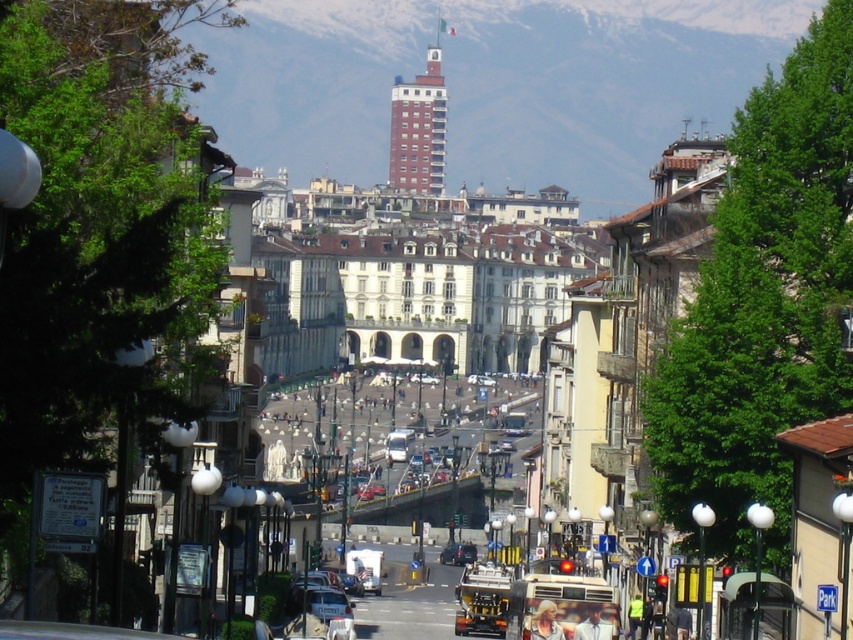
From the picture: Can you confirm if white snow-covered mountain at upper center is positioned above metallic silver car at center?

Indeed, white snow-covered mountain at upper center is positioned over metallic silver car at center.

Who is more forward, (461, 124) or (453, 554)?

Point (453, 554) is in front.

Is point (520, 44) more distant than point (459, 552)?

That is True.

Where is `white snow-covered mountain at upper center`? This screenshot has height=640, width=853. white snow-covered mountain at upper center is located at coordinates (490, 84).

Which is more to the left, white snow-covered mountain at upper center or light brown hair at center?

light brown hair at center is more to the left.

Which of these two, white snow-covered mountain at upper center or light brown hair at center, stands taller?

white snow-covered mountain at upper center is taller.

This screenshot has height=640, width=853. I want to click on white snow-covered mountain at upper center, so click(x=490, y=84).

Between light brown hair at center and metallic silver car at center, which one appears on the right side from the viewer's perspective?

light brown hair at center

Measure the distance from light brown hair at center to metallic silver car at center.

A distance of 43.62 meters exists between light brown hair at center and metallic silver car at center.

This screenshot has width=853, height=640. I want to click on light brown hair at center, so click(x=544, y=621).

Identify the location of light brown hair at center. (544, 621).